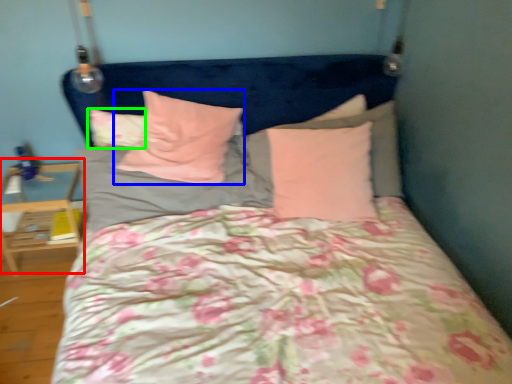
Question: Based on their relative distances, which object is nearer to table (highlighted by a red box)? Choose from pillow (highlighted by a blue box) and pillow (highlighted by a green box).

Choices:
 (A) pillow
 (B) pillow

Answer: (B)